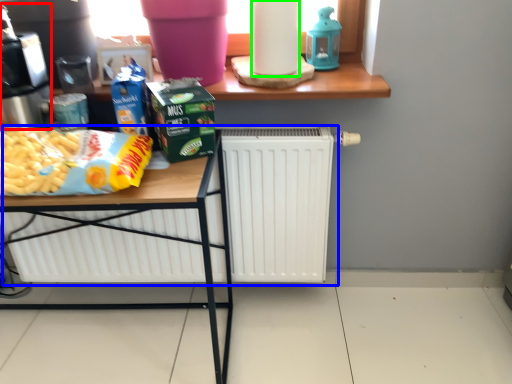
Question: Which is farther away from coffee machine (highlighted by a red box)? radiator (highlighted by a blue box) or paper towel (highlighted by a green box)?

Choices:
 (A) radiator
 (B) paper towel

Answer: (A)